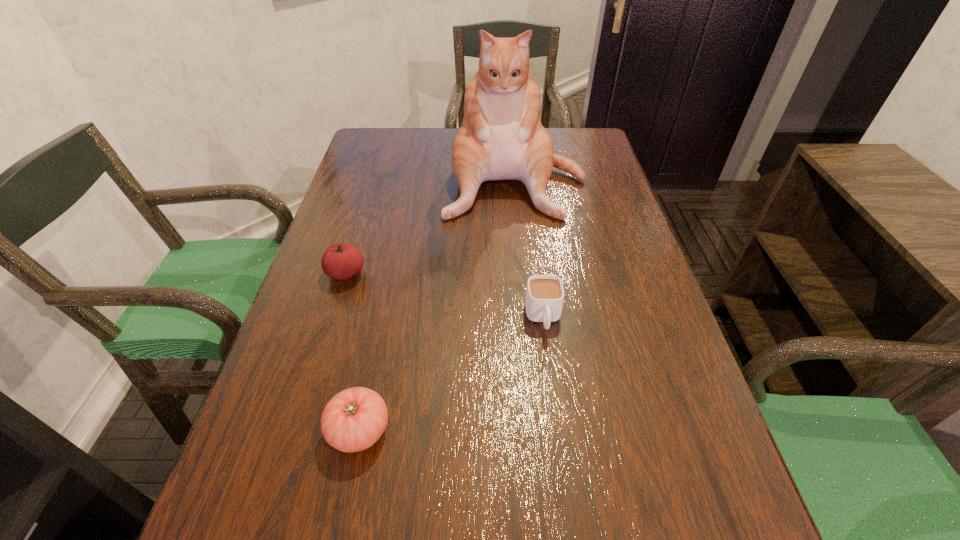
Find the location of a particular element. free point between the right tomato and the tallest object is located at coordinates (437, 305).

The image size is (960, 540). What are the coordinates of `empty space between the right tomato and the cup` in the screenshot? It's located at (451, 374).

Locate an element on the screen. This screenshot has width=960, height=540. free space that is in between the nearer tomato and the left tomato is located at coordinates (352, 352).

This screenshot has height=540, width=960. I want to click on vacant point located between the third farthest object and the right tomato, so point(451,374).

Choose which object is the nearest neighbor to the right tomato. Please provide its 2D coordinates. Your answer should be formatted as a tuple, i.e. [(x, y)], where the tuple contains the x and y coordinates of a point satisfying the conditions above.

[(342, 261)]

Where is `object that is the second closest one to the nearer tomato`? object that is the second closest one to the nearer tomato is located at coordinates (544, 298).

At what (x,y) coordinates should I click in order to perform the action: click on free space that satisfies the following two spatial constraints: 1. on the front side of the right tomato; 2. on the right side of the third nearest object. Please return your answer as a coordinate pair (x, y). The image size is (960, 540). Looking at the image, I should click on (298, 430).